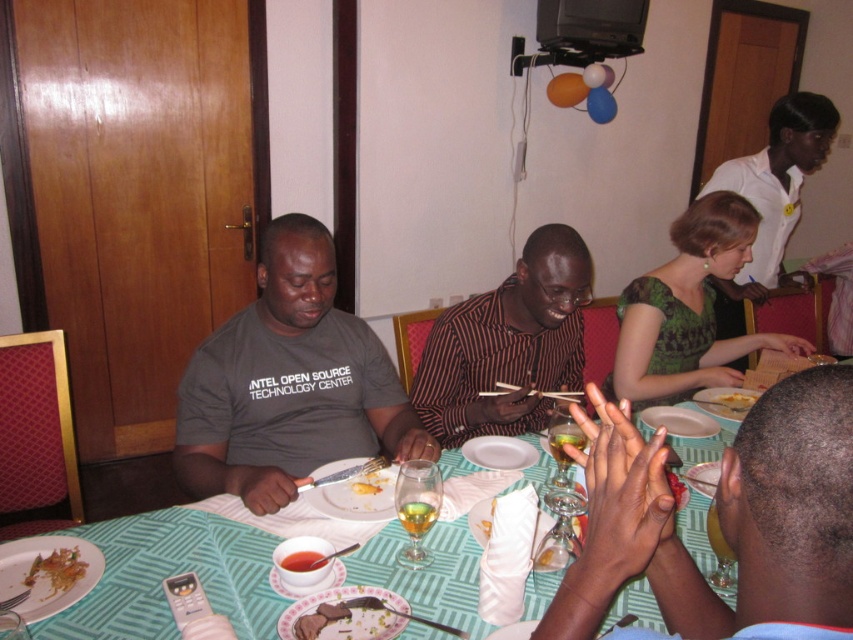
Question: Can you confirm if gray matte t-shirt at center is positioned to the right of greasy plastic plate at lower left?

Choices:
 (A) no
 (B) yes

Answer: (B)

Question: Which of these objects is positioned closest to the gray matte t-shirt at center?

Choices:
 (A) chocolate glazed cake at lower center
 (B) yellow matte cake at center
 (C) smooth skin hands at center
 (D) yellow creamy food at center

Answer: (D)

Question: Which point appears farthest from the camera in this image?

Choices:
 (A) (547, 264)
 (B) (68, 560)
 (C) (47, 570)
 (D) (370, 476)

Answer: (A)

Question: Is striped shirt at center behind yellow creamy food at center?

Choices:
 (A) no
 (B) yes

Answer: (B)

Question: Which of the following is the farthest from the observer?

Choices:
 (A) (61, 577)
 (B) (535, 241)
 (C) (804, 147)

Answer: (C)

Question: Does smooth skin hands at center have a greater width compared to yellow creamy food at center?

Choices:
 (A) no
 (B) yes

Answer: (B)